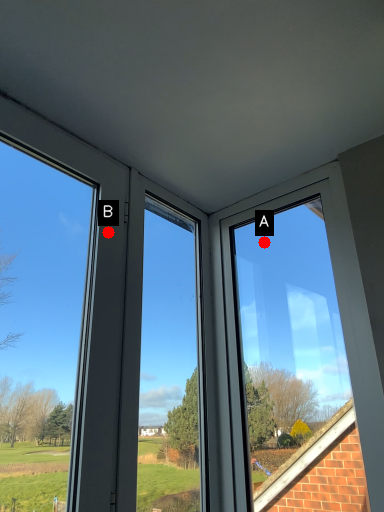
Question: Two points are circled on the image, labeled by A and B beside each circle. Which point is farther from the camera taking this photo?

Choices:
 (A) A is further
 (B) B is further

Answer: (A)